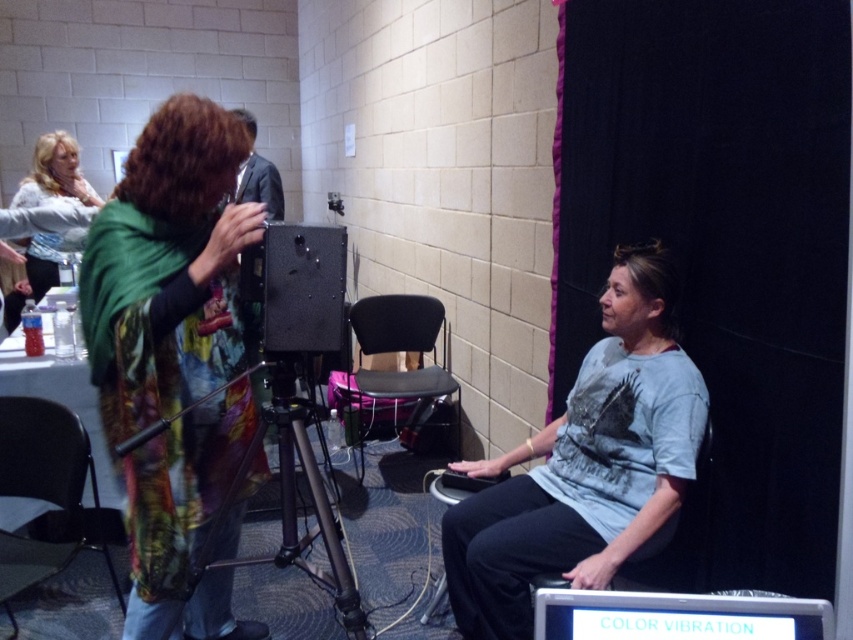
Question: Based on their relative distances, which object is nearer to the metallic tripod at center?

Choices:
 (A) metallic gray chair at lower left
 (B) gray cotton shirt at center
 (C) printed fabric scarf at left
 (D) light blue fabric shirt at upper left

Answer: (C)

Question: Does printed fabric scarf at left appear on the left side of black fabric chair at center?

Choices:
 (A) yes
 (B) no

Answer: (A)

Question: Estimate the real-world distances between objects in this image. Which object is farther from the light blue fabric shirt at upper left?

Choices:
 (A) metallic tripod at center
 (B) white plastic computer at lower center

Answer: (B)

Question: Is printed fabric scarf at left to the right of gray cotton shirt at center from the viewer's perspective?

Choices:
 (A) no
 (B) yes

Answer: (A)

Question: Can you confirm if metallic gray chair at lower left is smaller than light blue fabric shirt at upper left?

Choices:
 (A) no
 (B) yes

Answer: (B)

Question: Which point is closer to the camera taking this photo?

Choices:
 (A) (194, 561)
 (B) (775, 627)
 (C) (489, 516)
 (D) (135, 353)

Answer: (B)